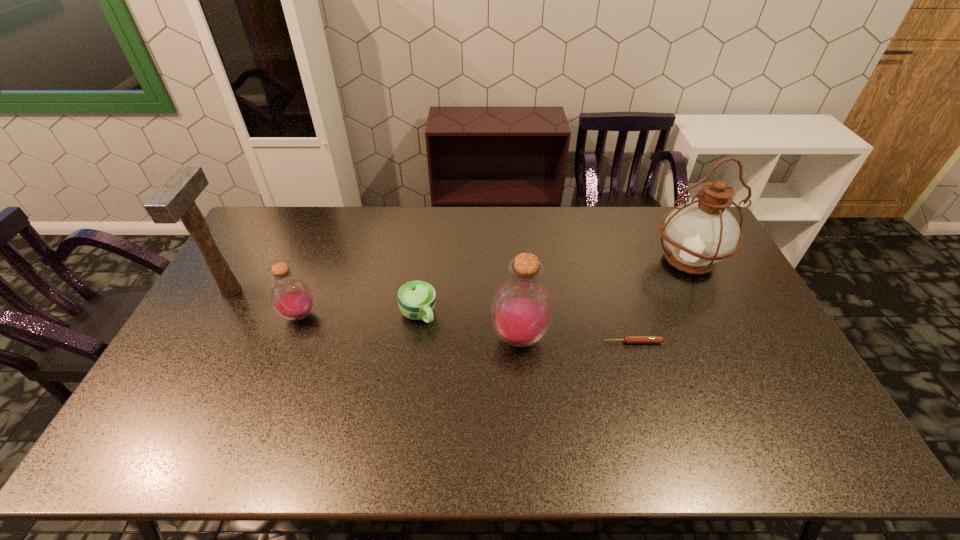
I want to click on free point that keeps the bottles evenly spaced on the right, so click(x=761, y=362).